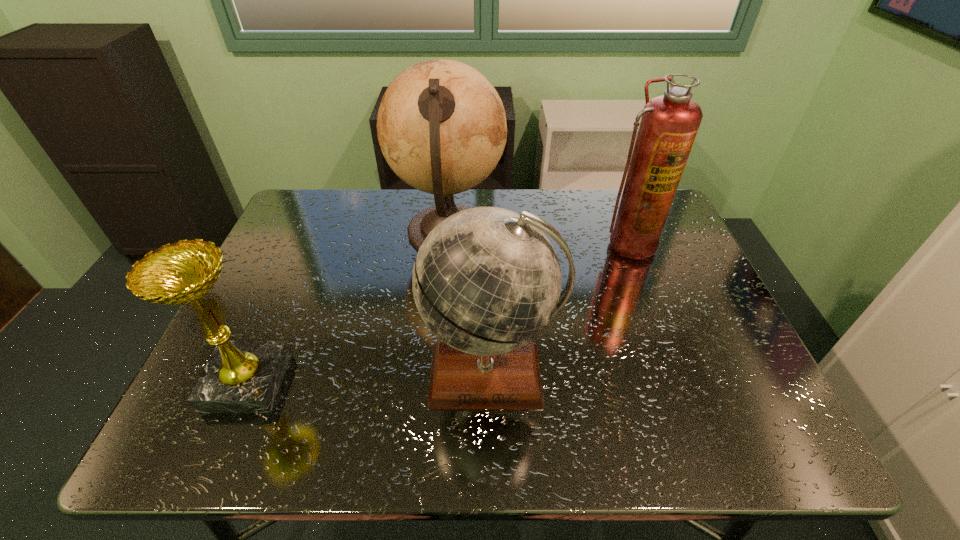
Find the location of a particular element. The width and height of the screenshot is (960, 540). globe that is at the near edge is located at coordinates (486, 281).

At what (x,y) coordinates should I click in order to perform the action: click on award that is positioned at the near edge. Please return your answer as a coordinate pair (x, y). This screenshot has width=960, height=540. Looking at the image, I should click on (241, 376).

At what (x,y) coordinates should I click in order to perform the action: click on object at the left edge. Please return your answer as a coordinate pair (x, y). Looking at the image, I should click on (241, 376).

Identify the location of object that is at the right edge. The width and height of the screenshot is (960, 540). (669, 124).

Find the location of a particular element. The width and height of the screenshot is (960, 540). object at the near left corner is located at coordinates (241, 376).

Image resolution: width=960 pixels, height=540 pixels. Find the location of `object that is at the far right corner`. object that is at the far right corner is located at coordinates click(x=669, y=124).

You are a GUI agent. You are given a task and a screenshot of the screen. Output one action in this format:
    pyautogui.click(x=<x>, y=<y>)
    Task: Click on the free point at the far edge
    The height and width of the screenshot is (540, 960).
    Given the screenshot: What is the action you would take?
    pyautogui.click(x=602, y=230)

Find the location of a particular element. vacant space at the left edge is located at coordinates (323, 250).

Locate an element on the screen. This screenshot has width=960, height=540. vacant region at the right edge of the desktop is located at coordinates (722, 389).

The image size is (960, 540). What are the coordinates of `free point at the far left corner` in the screenshot? It's located at (332, 210).